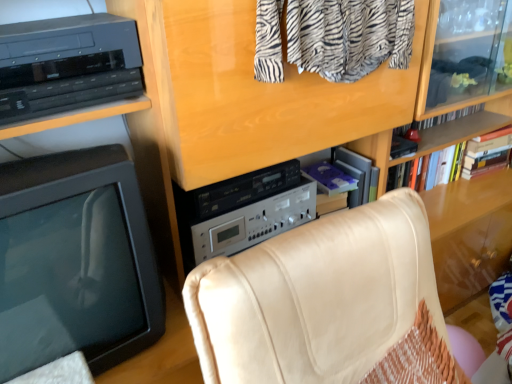
Locate an element on the screen. Image resolution: width=512 pixels, height=384 pixels. free space above purple matte book at center, the first book when ordered from left to right (from a real-world perspective) is located at coordinates click(x=332, y=173).